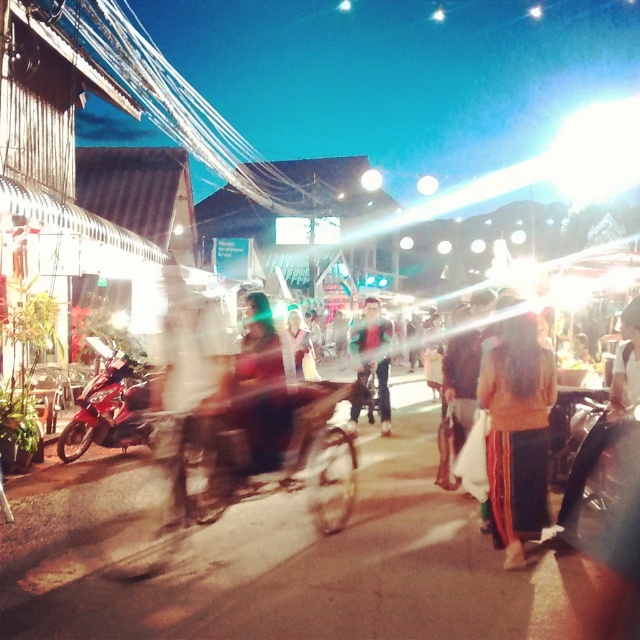
Question: Does shiny red motorcycle at left have a smaller size compared to dark blue jeans at center?

Choices:
 (A) yes
 (B) no

Answer: (A)

Question: Which point is closer to the camera taking this photo?

Choices:
 (A) (531, 365)
 (B) (88, 410)
 (C) (360, 404)

Answer: (A)

Question: Among these points, which one is nearest to the camera?

Choices:
 (A) (376, 346)
 (B) (509, 545)
 (C) (102, 429)

Answer: (B)

Question: Which point is farther to the camera?

Choices:
 (A) (116, 360)
 (B) (376, 355)

Answer: (B)

Question: Is shiny red motorcycle at left wider than dark blue jeans at center?

Choices:
 (A) yes
 (B) no

Answer: (B)

Question: Observing the image, what is the correct spatial positioning of shiny red motorcycle at left in reference to dark blue jeans at center?

Choices:
 (A) below
 (B) above

Answer: (A)